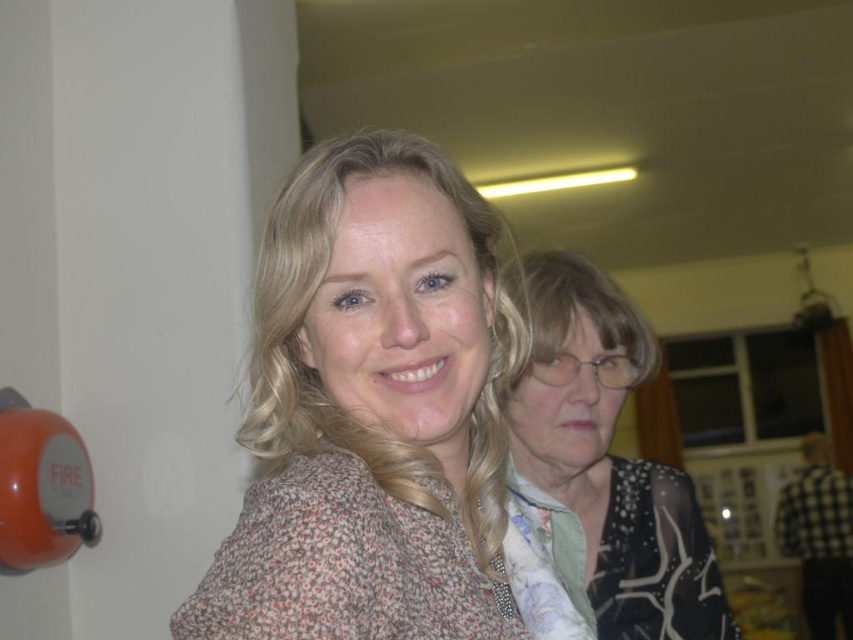
Between point (270, 376) and point (608, 557), which one is positioned behind?

Positioned behind is point (608, 557).

Is floral-patterned fabric at center behind black dotted blouse at right?

No, floral-patterned fabric at center is in front of black dotted blouse at right.

Image resolution: width=853 pixels, height=640 pixels. In order to click on floral-patterned fabric at center in this screenshot , I will do `click(360, 433)`.